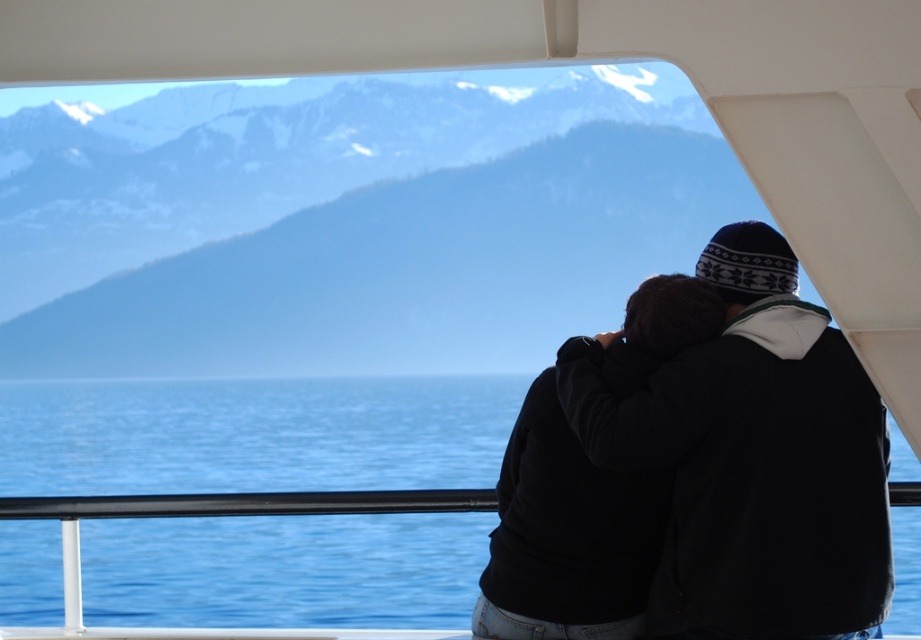
You are standing on the boat and want to reach the point marked at coordinates [458,140]. If your current position is 5 meters away from the edge of the boat, can you safely walk to that point without falling into the water?

The distance of point [458,140] from viewer is 55.69 meters. Since you are only 5 meters away from the edge, you can safely walk to the point as it is much closer than the distance to the water.

From the picture: You are navigating a boat and need to adjust your course to avoid a rocky area ahead. The snowy mountain range at upper left is your reference point. Based on its position, which direction should you steer the boat to move away from the rocky area?

The snowy mountain range at upper left is located at point (360, 230), so steering the boat towards the opposite direction of the snowy mountain range at upper left would help avoid the rocky area.